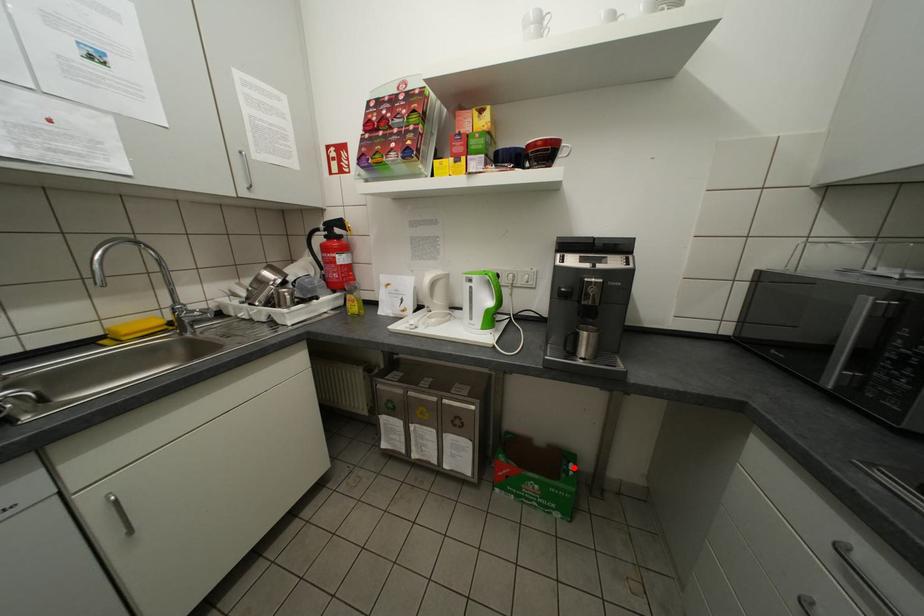
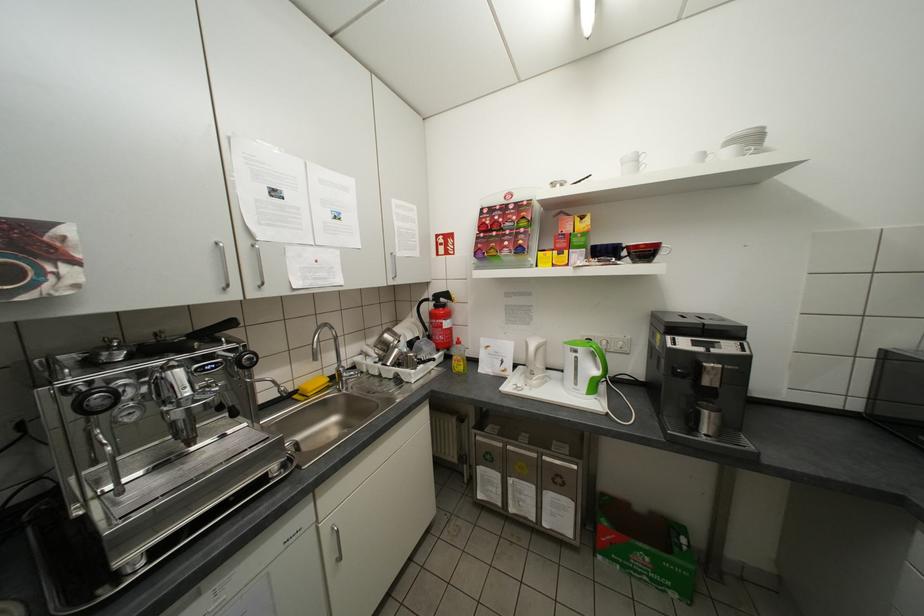
Find the pixel in the second image that matches the highlighted location in the first image.

(685, 541)